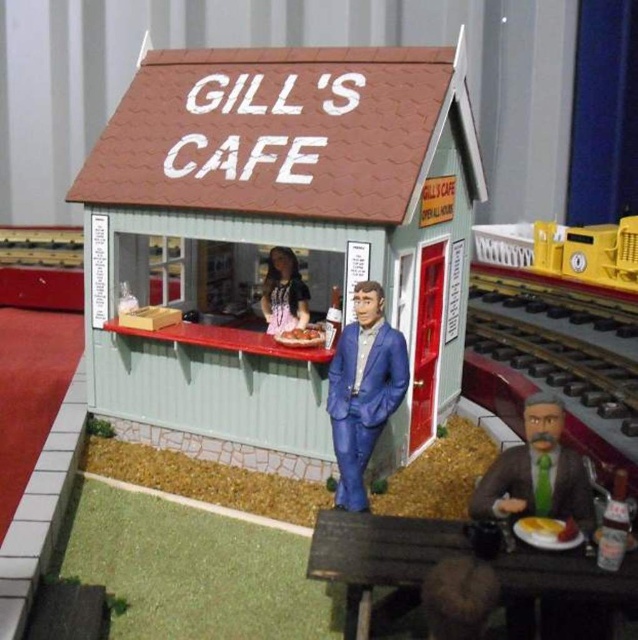
You are a customer at Gill Cafe and want to place your bag on the green fabric suit at lower right. However, there is a yellow plastic train at right nearby. Which object is closer to you so you can safely place your bag there?

The green fabric suit at lower right is closer to the viewer than the yellow plastic train at right, so you can safely place your bag there.

You are a customer at Gill Cafe and want to know if the blue plastic figure at center can fit inside the green corrugated metal hut at center. Based on their sizes, can it fit?

The green corrugated metal hut at center is bigger than the blue plastic figure at center, so yes, the blue plastic figure at center can fit inside the green corrugated metal hut at center.